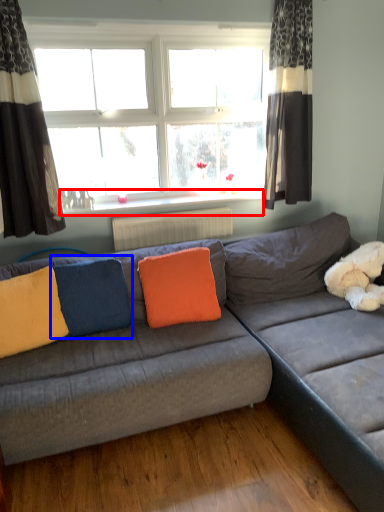
Question: Which of the following is the closest to the observer, window sill (highlighted by a red box) or pillow (highlighted by a blue box)?

Choices:
 (A) window sill
 (B) pillow

Answer: (B)